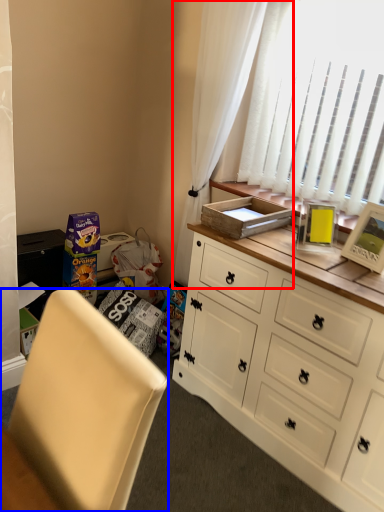
Question: Which of the following is the farthest to the observer, curtain (highlighted by a red box) or chair (highlighted by a blue box)?

Choices:
 (A) curtain
 (B) chair

Answer: (A)